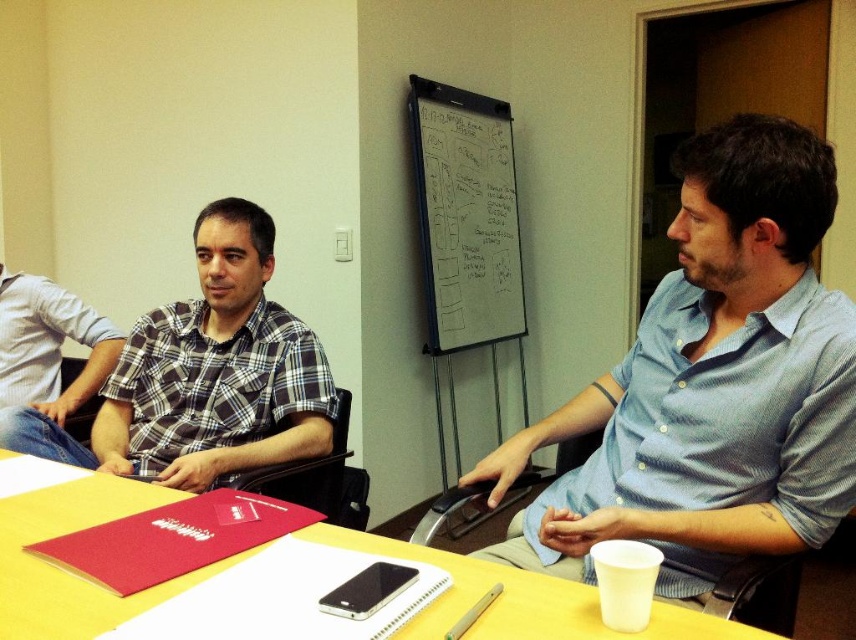
You are an interior designer observing the conference room setup. You notice the plaid cotton shirt at center and the matte plaid shirt at center. Which shirt appears to be closer to the camera based on their sizes?

The plaid cotton shirt at center is taller than the matte plaid shirt at center, so it appears closer to the camera.

You are organizing a clothing donation drive and need to stack shirts vertically in a box. You have a plaid cotton shirt at center and a matte plaid shirt at center. Which shirt should you place on top to ensure the one with the more delicate fabric is protected?

The plaid cotton shirt at center should be placed on top of the matte plaid shirt at center because the plaid cotton shirt at center is already positioned over the matte plaid shirt at center, indicating it might be more durable or the preferred top layer.

You are organizing a meeting and need to ensure that the blue striped shirt at center can be seen clearly by everyone. Since the yellow matte table at center is in the way, can you move the table to make space? Please explain based on their sizes.

The blue striped shirt at center is larger than the yellow matte table at center. However, the table is an inanimate object and cannot be moved by its size alone. You would need to physically relocate it regardless of size differences.